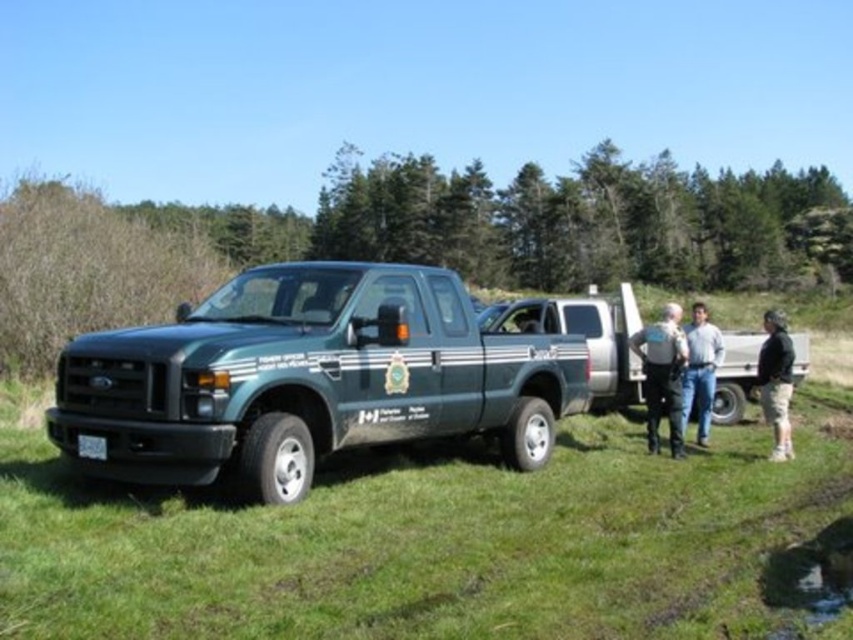
You are standing at the point marked by the coordinates point [445,541] in the image. What is the first object you would encounter if you walk straight ahead towards the dark green Ford pickup truck with white stripes?

The first object you would encounter is the green grass at lower left, as the point marks its location, and walking towards the dark green Ford pickup truck would first pass through the green grass area before reaching the truck.

You are a park ranger who needs to choose a vehicle to carry a large fallen tree trunk that requires a truck bed with at least 10 cubic feet of space. Based on the scene, which truck between the green matte truck at left and the silver metallic pickup truck at center would you recommend?

The silver metallic pickup truck at center is larger than the green matte truck at left, so it likely has a larger truck bed and can accommodate the large fallen tree trunk requiring at least 10 cubic feet of space.